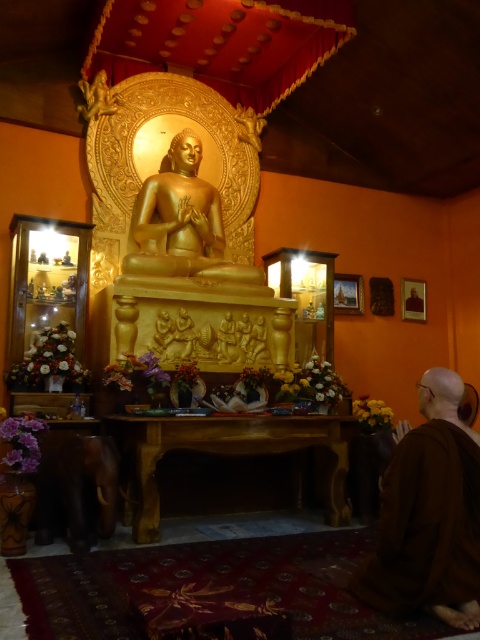
You are standing in the temple and want to place a small offering at the point marked as point (213,243). If your arm can reach up to 1.5 meters, can you reach that point without moving closer?

The distance of point (213,243) from the camera is 5.24 meters. Since your arm can only reach up to 1.5 meters, you cannot reach that point without moving closer.

You are a temple visitor who wants to place a small offering on the highest available surface in the scene. Which object should you choose between the brown cloth at lower right and the wooden altar at center?

The wooden altar at center is taller than the brown cloth at lower right, so you should place the offering on the wooden altar at center.

You are a temple visitor standing at the entrance of the temple. You want to place a small offering on the brown cloth at lower right. Can you reach it without moving closer than 2 meters?

The brown cloth at lower right is 2.29 meters away from the viewer. Since 2.29 meters is more than 2 meters, you cannot reach it without moving closer.